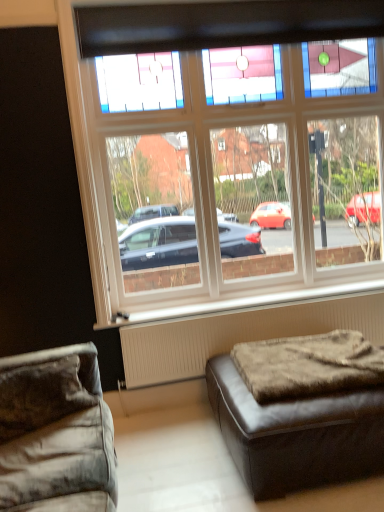
Question: Is brown fuzzy ottoman at lower right wider than clear glass window at upper center?

Choices:
 (A) no
 (B) yes

Answer: (B)

Question: Is brown fuzzy ottoman at lower right positioned far away from clear glass window at upper center?

Choices:
 (A) yes
 (B) no

Answer: (B)

Question: From a real-world perspective, is brown fuzzy ottoman at lower right beneath clear glass window at upper center?

Choices:
 (A) no
 (B) yes

Answer: (B)

Question: Can you confirm if brown fuzzy ottoman at lower right is positioned to the right of clear glass window at upper center?

Choices:
 (A) yes
 (B) no

Answer: (A)

Question: From the image's perspective, would you say brown fuzzy ottoman at lower right is shown under clear glass window at upper center?

Choices:
 (A) yes
 (B) no

Answer: (A)

Question: From a real-world perspective, is brown fuzzy ottoman at lower right above or below white textured radiator at lower right?

Choices:
 (A) above
 (B) below

Answer: (A)

Question: Considering their positions, is brown fuzzy ottoman at lower right located in front of or behind white textured radiator at lower right?

Choices:
 (A) behind
 (B) front

Answer: (B)

Question: Is brown fuzzy ottoman at lower right wider or thinner than white textured radiator at lower right?

Choices:
 (A) thin
 (B) wide

Answer: (B)

Question: Would you say brown fuzzy ottoman at lower right is inside or outside white textured radiator at lower right?

Choices:
 (A) outside
 (B) inside

Answer: (A)

Question: Based on their sizes in the image, would you say brown fuzzy ottoman at lower right is bigger or smaller than clear glass window at upper center?

Choices:
 (A) big
 (B) small

Answer: (B)

Question: From the image's perspective, is brown fuzzy ottoman at lower right positioned above or below clear glass window at upper center?

Choices:
 (A) above
 (B) below

Answer: (B)

Question: Based on their positions, is brown fuzzy ottoman at lower right located to the left or right of clear glass window at upper center?

Choices:
 (A) left
 (B) right

Answer: (B)

Question: Is brown fuzzy ottoman at lower right taller or shorter than clear glass window at upper center?

Choices:
 (A) tall
 (B) short

Answer: (B)

Question: Is white textured radiator at lower right bigger or smaller than clear glass window at upper center?

Choices:
 (A) big
 (B) small

Answer: (B)

Question: Is point (226, 336) closer or farther from the camera than point (349, 57)?

Choices:
 (A) farther
 (B) closer

Answer: (B)